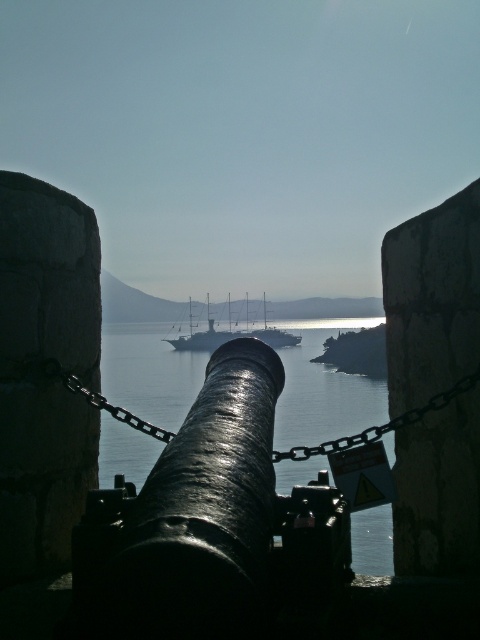
You are a sailor trying to navigate through the coastal scene. You see the glossy water at cannon center and the smooth blue water at center. Which body of water is positioned to the right side of the other?

The glossy water at cannon center is to the right of smooth blue water at center.

You are a sailor planning to navigate a small boat through the waters in this coastal scene. You notice two distinct water areas labeled as glossy water at cannon center and smooth blue water at center. Which water area is bigger in size and would provide more space for your boat?

The glossy water at cannon center has a larger size compared to the smooth blue water at center, so it would provide more space for your boat.